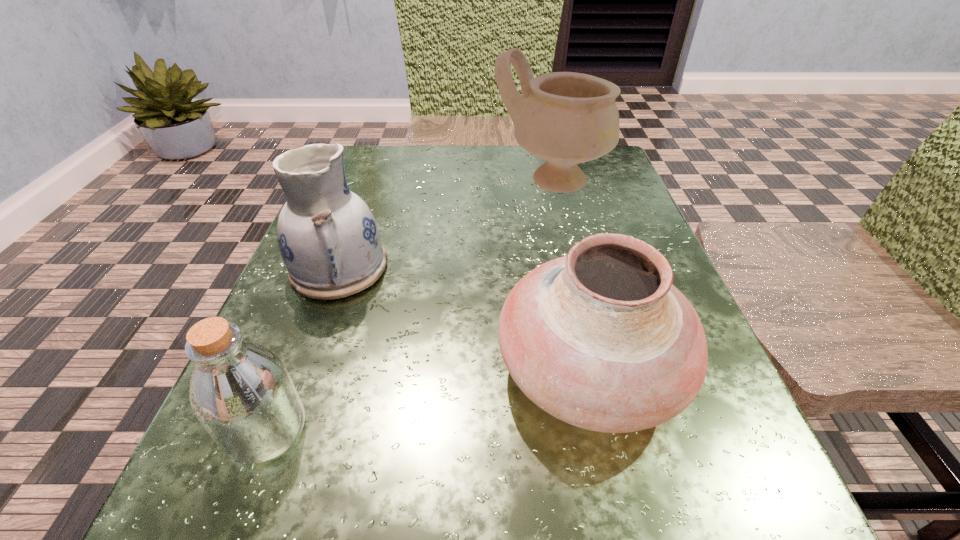
This screenshot has width=960, height=540. I want to click on blank space that satisfies the following two spatial constraints: 1. on the back side of the second farthest pottery; 2. on the left side of the farthest pottery, so click(x=371, y=180).

What are the coordinates of `free location that satisfies the following two spatial constraints: 1. on the front side of the nearest pottery; 2. on the left side of the second farthest pottery` in the screenshot? It's located at 302,370.